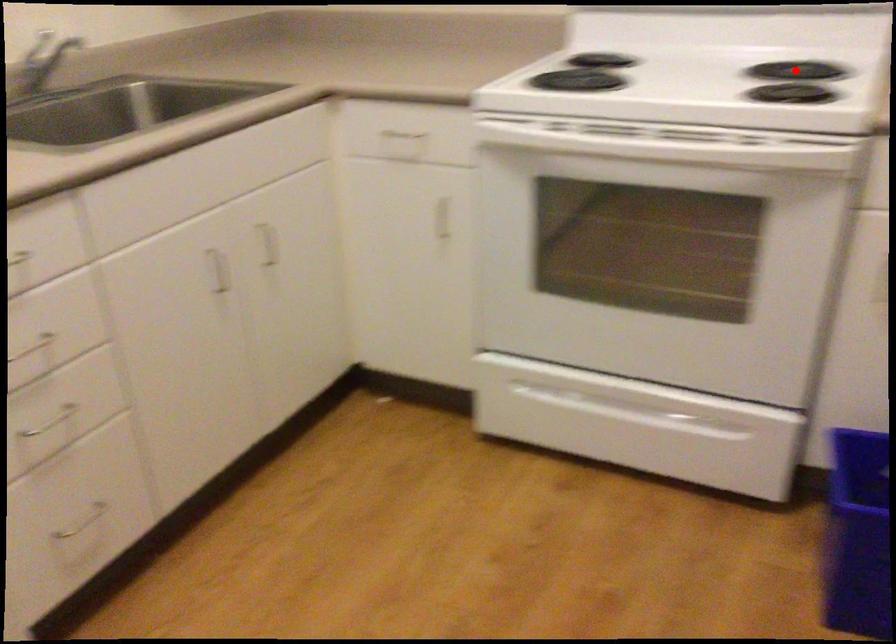
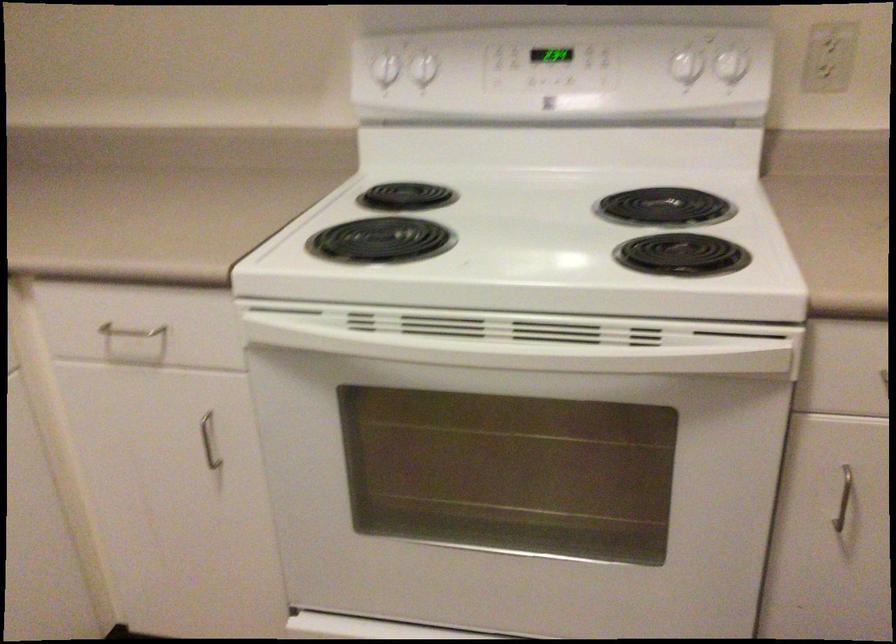
Question: I am providing you with two images of the same scene from different viewpoints. Image1 has a red point marked. In image2, the corresponding 3D location appears at what relative position? Reply with the corresponding letter.

Choices:
 (A) Closer
 (B) Farther

Answer: (A)